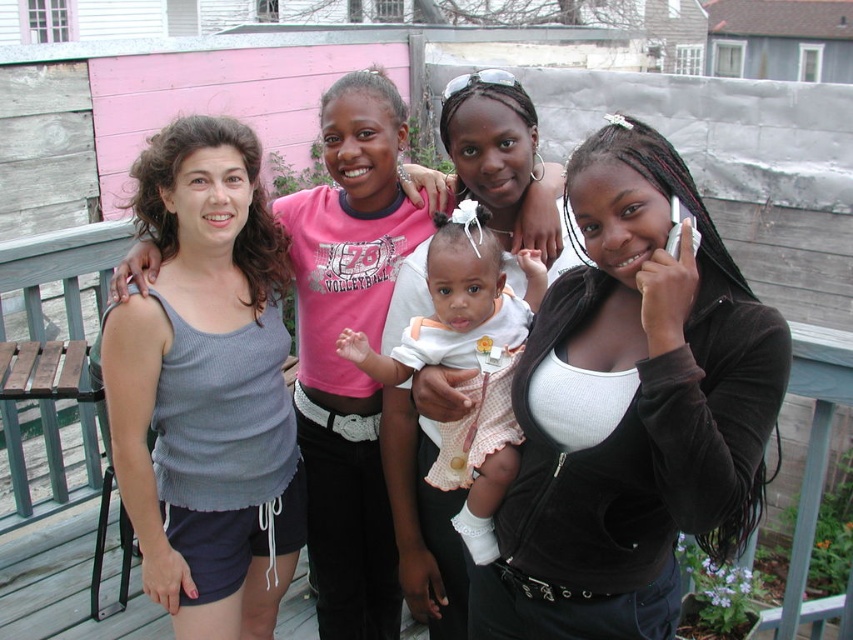
You are standing at the center of the wooden deck and want to hand a gift to the person wearing the gray ribbed tank top at center. In which direction should you move to reach them?

The gray ribbed tank top at center is located at point (207, 387), so you should move towards the right and slightly forward to reach them.

You are trying to decide which clothing item to take with you for a quick errand. You see the black velvet jacket at upper right and the gray ribbed tank top at center. Which one is shorter in height?

The black velvet jacket at upper right is not as tall as the gray ribbed tank top at center, so the black velvet jacket at upper right is shorter in height.

What is the location of the point at coordinates (631, 412) in the image?

The point at coordinates (631, 412) is on the black velvet jacket at upper right.